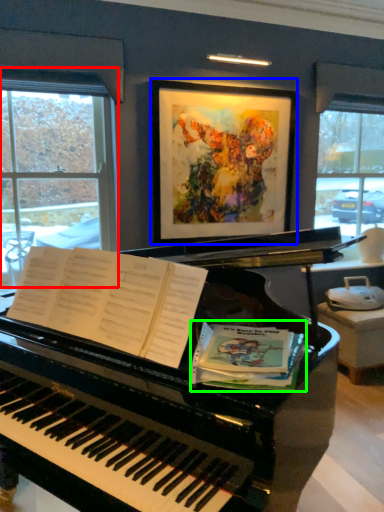
Question: Which is farther away from window (highlighted by a red box)? picture frame (highlighted by a blue box) or paperback book (highlighted by a green box)?

Choices:
 (A) picture frame
 (B) paperback book

Answer: (B)